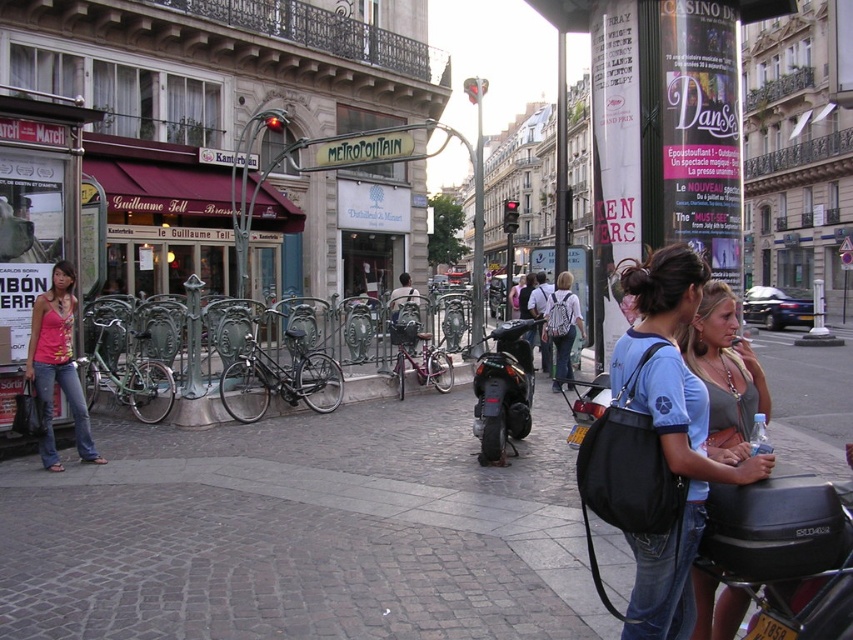
Is cobblestone pavement at center wider than denim jeans at lower left?

Correct, the width of cobblestone pavement at center exceeds that of denim jeans at lower left.

What do you see at coordinates (303, 531) in the screenshot?
I see `cobblestone pavement at center` at bounding box center [303, 531].

Image resolution: width=853 pixels, height=640 pixels. What are the coordinates of `cobblestone pavement at center` in the screenshot? It's located at (303, 531).

Does cobblestone pavement at center come in front of matte blue shirt at center?

No.

Who is more distant from viewer, (534, 573) or (724, 371)?

Positioned behind is point (534, 573).

Which is behind, point (42, 545) or point (723, 636)?

Point (42, 545)

You are a GUI agent. You are given a task and a screenshot of the screen. Output one action in this format:
    pyautogui.click(x=<x>, y=<y>)
    Task: Click on the cobblestone pavement at center
    Image resolution: width=853 pixels, height=640 pixels.
    Given the screenshot: What is the action you would take?
    pyautogui.click(x=303, y=531)

Does black matte bicycle at center have a larger size compared to green matte bicycle at left?

Correct, black matte bicycle at center is larger in size than green matte bicycle at left.

Based on the photo, which is below, black matte bicycle at center or green matte bicycle at left?

green matte bicycle at left is below.

Describe the element at coordinates (279, 376) in the screenshot. I see `black matte bicycle at center` at that location.

The image size is (853, 640). What are the coordinates of `black matte bicycle at center` in the screenshot? It's located at (279, 376).